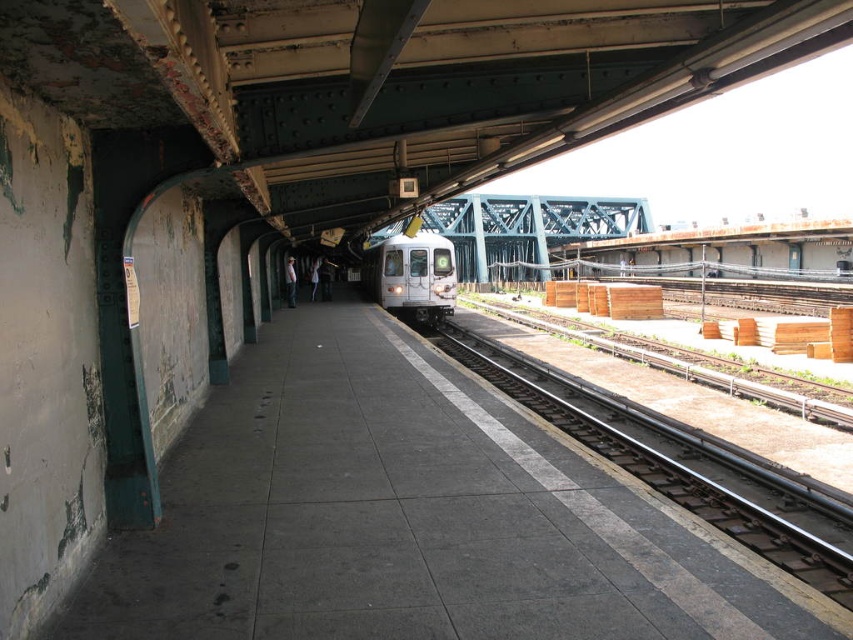
You are standing at point (659, 467) on the train station platform. What object is located at this point?

The metal smooth train track at right is located at point (659, 467).